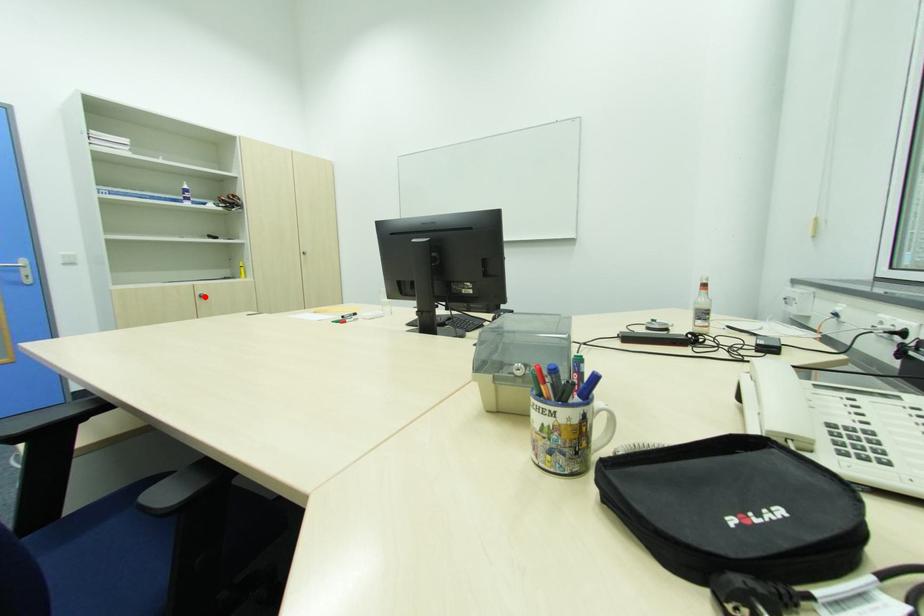
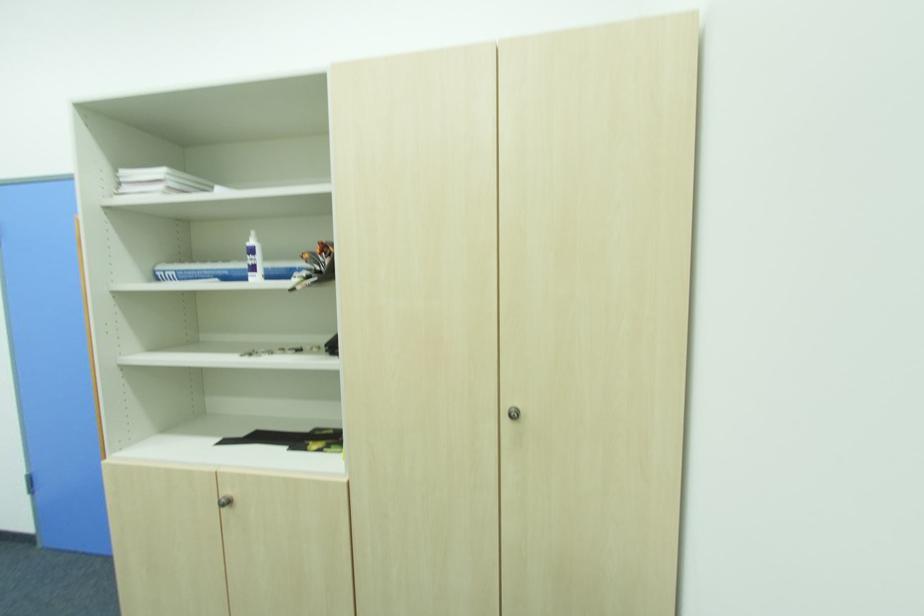
The point at the highlighted location is marked in the first image. Where is the corresponding point in the second image?

(229, 504)